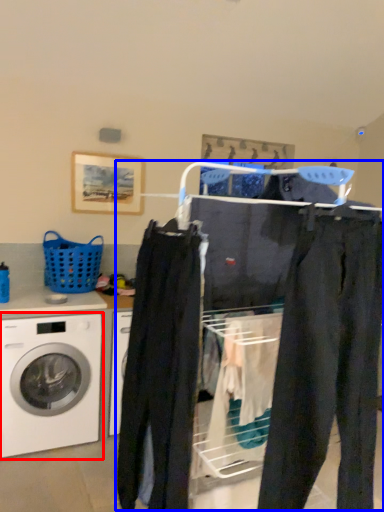
Question: Which of the following is the farthest to the observer, washing machine (highlighted by a red box) or closet (highlighted by a blue box)?

Choices:
 (A) washing machine
 (B) closet

Answer: (A)